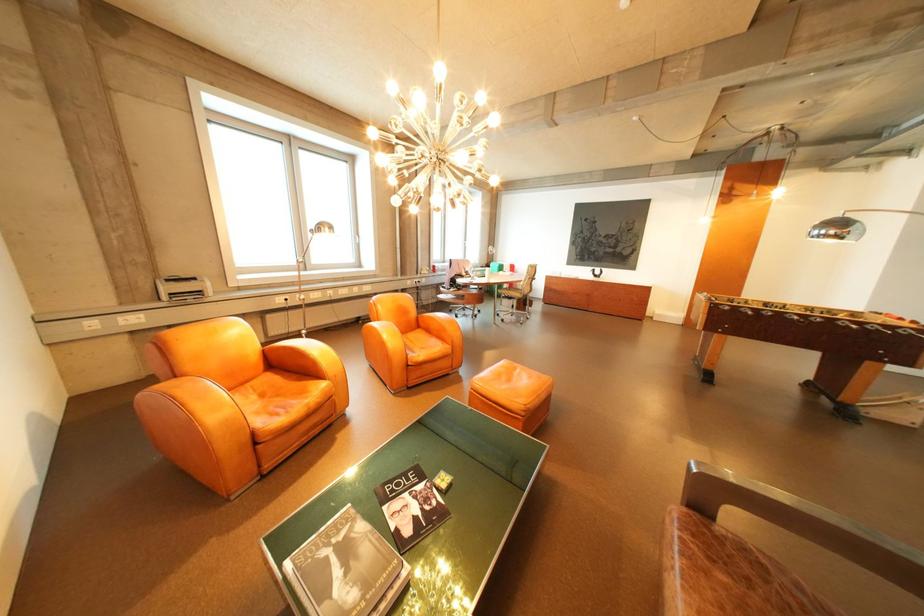
Describe the element at coordinates (513, 385) in the screenshot. I see `the orange leather ottoman` at that location.